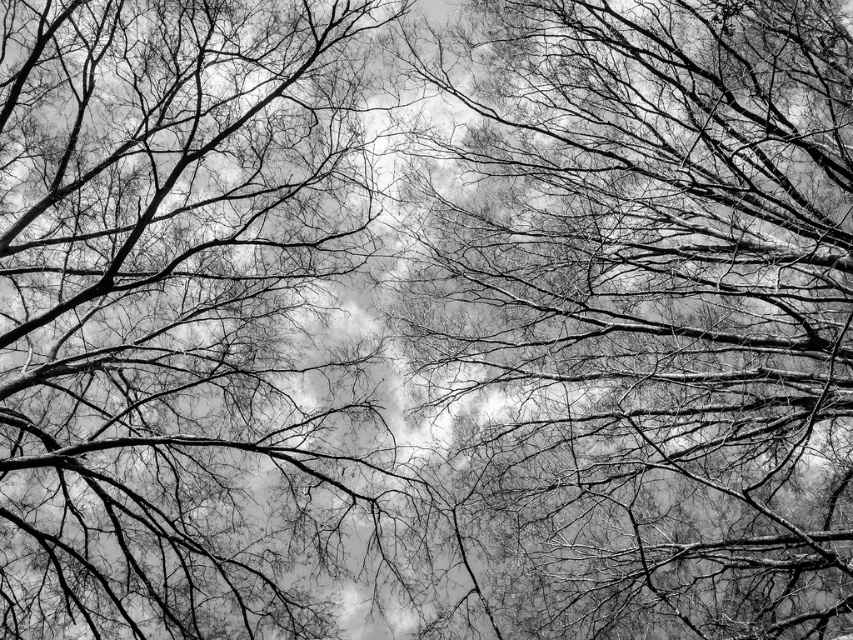
Question: Can you confirm if smooth bark tree at center is positioned to the left of silhouette branches at center?

Choices:
 (A) yes
 (B) no

Answer: (B)

Question: Is smooth bark tree at center closer to camera compared to silhouette branches at center?

Choices:
 (A) no
 (B) yes

Answer: (A)

Question: Can you confirm if smooth bark tree at center is bigger than silhouette branches at center?

Choices:
 (A) yes
 (B) no

Answer: (B)

Question: Which point is closer to the camera?

Choices:
 (A) (254, 406)
 (B) (822, 531)

Answer: (B)

Question: Which point is farther to the camera?

Choices:
 (A) silhouette branches at center
 (B) smooth bark tree at center

Answer: (B)